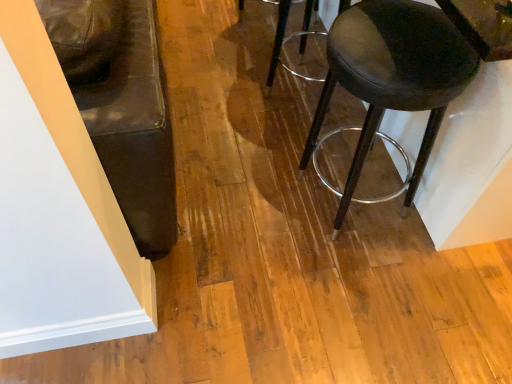
Identify the location of vacant region in front of matte black stool at right, the 1th stool positioned from the bottom. The image size is (512, 384). pyautogui.click(x=358, y=286).